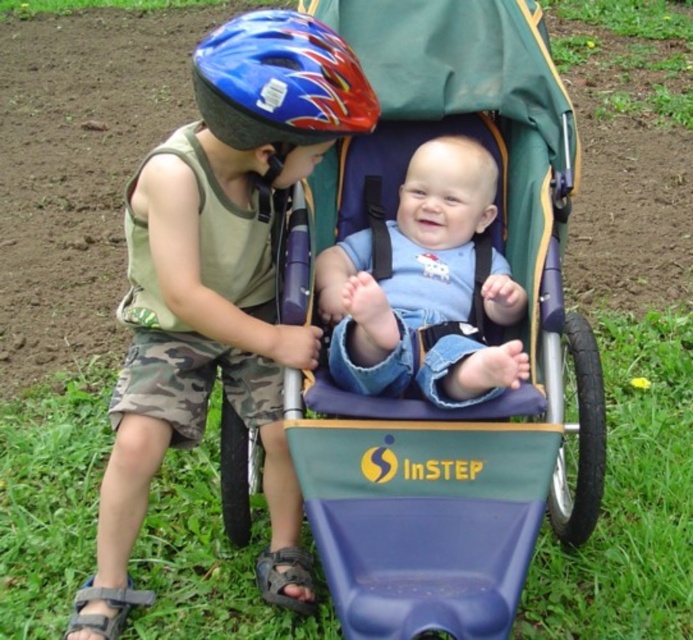
You are a parent trying to load items into your car trunk. The trunk has a height limit of 1 meter. You have the blue plastic stroller at center and the matte blue helmet at center. Which item will not fit in the trunk vertically due to its height?

The blue plastic stroller at center is much taller than the matte blue helmet at center, so the blue plastic stroller at center will not fit in the trunk vertically due to its height.

You are a photographer trying to capture a clear photo of both the blue plastic stroller at center and the matte blue helmet at center. Since you want both objects in focus, which one should you adjust your camera focus on first?

The blue plastic stroller at center is closer to the viewer than the matte blue helmet at center, so you should focus on the stroller first to ensure both are in focus.

From the picture: You are a photographer trying to capture a clear photo of both the blue denim shirt at center and the shiny blue helmet at upper left. If your camera has a depth of field that can focus on objects within 20 inches of each other, will both items be in focus?

The blue denim shirt at center and the shiny blue helmet at upper left are 19.77 inches apart from each other, so yes, both items will be in focus since the distance between them is within the 20 inches depth of field.